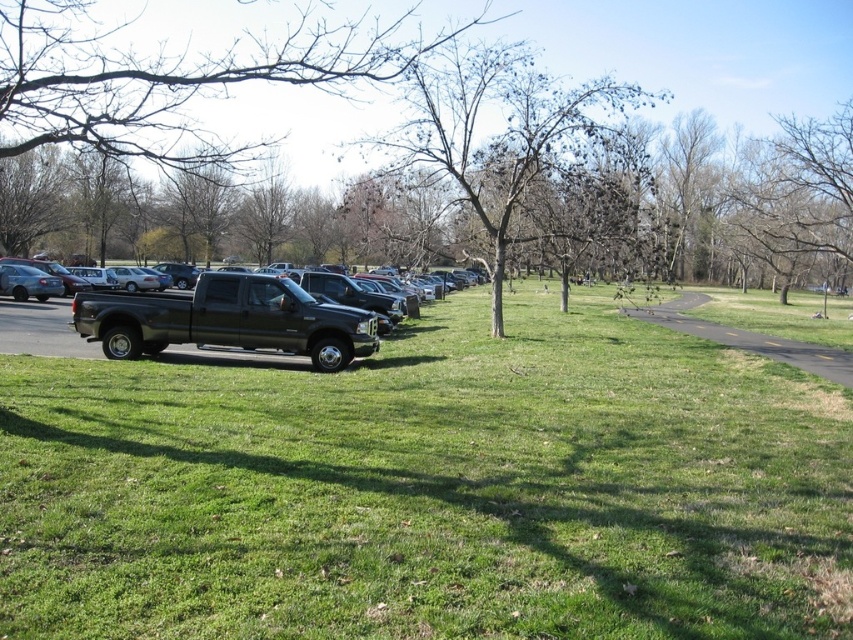
Question: In this image, where is green grassy field at center located relative to matte black truck at center?

Choices:
 (A) below
 (B) above

Answer: (A)

Question: Among these points, which one is nearest to the camera?

Choices:
 (A) (363, 612)
 (B) (209, 308)
 (C) (509, 184)

Answer: (A)

Question: Can you confirm if green grassy field at center is bigger than matte black truck at center?

Choices:
 (A) yes
 (B) no

Answer: (A)

Question: Can you confirm if green grassy field at center is bigger than matte black truck at center?

Choices:
 (A) yes
 (B) no

Answer: (A)

Question: Which point appears closest to the camera in this image?

Choices:
 (A) tap(496, 269)
 (B) tap(328, 314)

Answer: (B)

Question: Among these objects, which one is farthest from the camera?

Choices:
 (A) bare branches at center
 (B) green grassy field at center
 (C) matte black truck at center

Answer: (A)